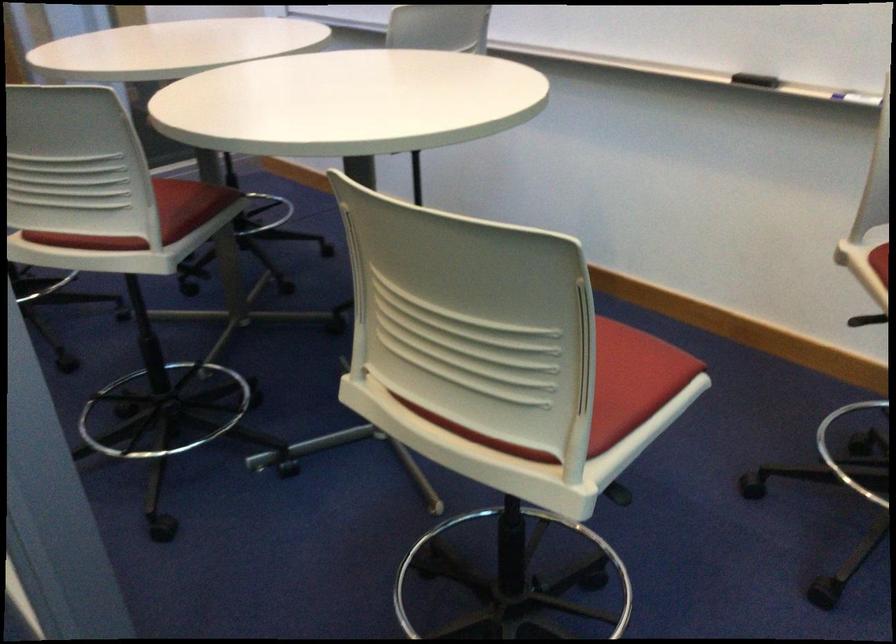
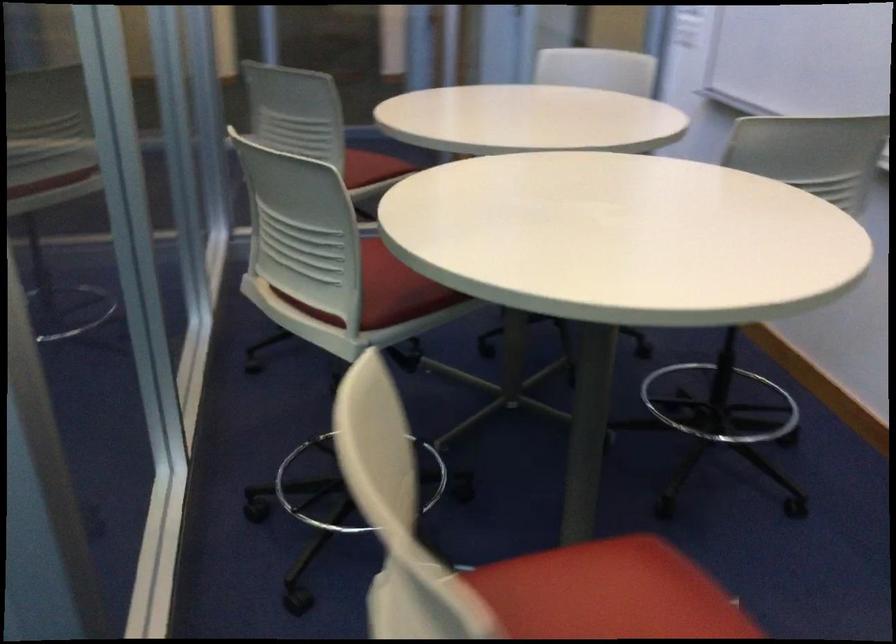
Find the pixel in the second image that matches pixel 169 207 in the first image.

(397, 289)